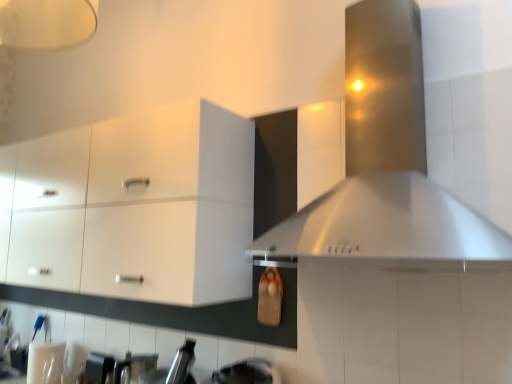
Question: From a real-world perspective, is metallic silver toaster at lower left located beneath stainless steel vent at upper right?

Choices:
 (A) no
 (B) yes

Answer: (B)

Question: Does metallic silver toaster at lower left touch stainless steel vent at upper right?

Choices:
 (A) yes
 (B) no

Answer: (B)

Question: Is metallic silver toaster at lower left outside of stainless steel vent at upper right?

Choices:
 (A) no
 (B) yes

Answer: (B)

Question: Can you confirm if metallic silver toaster at lower left is thinner than stainless steel vent at upper right?

Choices:
 (A) yes
 (B) no

Answer: (A)

Question: Considering the relative positions of metallic silver toaster at lower left and stainless steel vent at upper right in the image provided, is metallic silver toaster at lower left to the left of stainless steel vent at upper right from the viewer's perspective?

Choices:
 (A) no
 (B) yes

Answer: (B)

Question: Would you say white glossy cabinet at upper left is inside or outside stainless steel vent at upper right?

Choices:
 (A) inside
 (B) outside

Answer: (B)

Question: Is point (197, 210) positioned closer to the camera than point (488, 228)?

Choices:
 (A) closer
 (B) farther

Answer: (B)

Question: Is white glossy cabinet at upper left in front of or behind stainless steel vent at upper right in the image?

Choices:
 (A) behind
 (B) front

Answer: (A)

Question: Visually, is white glossy cabinet at upper left positioned to the left or to the right of stainless steel vent at upper right?

Choices:
 (A) right
 (B) left

Answer: (B)

Question: In terms of height, does stainless steel vent at upper right look taller or shorter compared to metallic silver toaster at lower left?

Choices:
 (A) short
 (B) tall

Answer: (B)

Question: Does point (495, 125) appear closer or farther from the camera than point (103, 362)?

Choices:
 (A) closer
 (B) farther

Answer: (A)

Question: From a real-world perspective, is stainless steel vent at upper right positioned above or below metallic silver toaster at lower left?

Choices:
 (A) below
 (B) above

Answer: (B)

Question: In the image, is stainless steel vent at upper right on the left side or the right side of metallic silver toaster at lower left?

Choices:
 (A) left
 (B) right

Answer: (B)

Question: Is stainless steel vent at upper right bigger or smaller than white glossy cabinet at upper left?

Choices:
 (A) small
 (B) big

Answer: (A)

Question: From a real-world perspective, is stainless steel vent at upper right positioned above or below white glossy cabinet at upper left?

Choices:
 (A) above
 (B) below

Answer: (A)